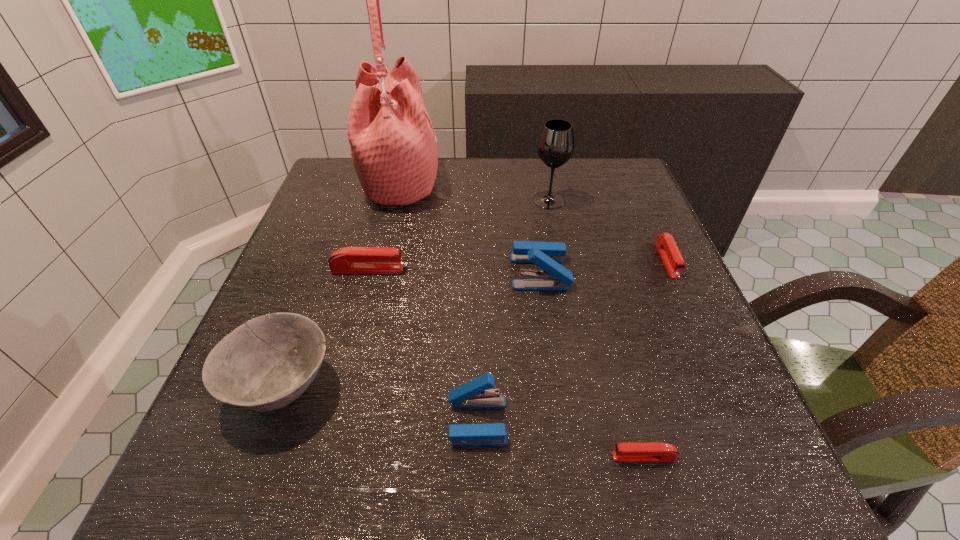
Identify the location of the second closest stapler to the smaller blue stapler. (547, 255).

Identify which red stapler is the third closest to the tallest object. Please provide its 2D coordinates. Your answer should be formatted as a tuple, i.e. [(x, y)], where the tuple contains the x and y coordinates of a point satisfying the conditions above.

[(648, 451)]

Locate an element on the screen. red stapler object that ranks as the second closest to the handbag is located at coordinates (665, 243).

Find the location of a particular element. blank space that satisfies the following two spatial constraints: 1. on the front-facing side of the rightmost stapler; 2. on the front-facing side of the nearest object is located at coordinates (756, 457).

What are the coordinates of `vacant space that satisfies the following two spatial constraints: 1. on the front-facing side of the rightmost stapler; 2. on the front-facing side of the shortest object` in the screenshot? It's located at (756, 457).

Where is `free spot that satisfies the following two spatial constraints: 1. on the front side of the wineglass; 2. on the front-facing side of the third tallest stapler`? free spot that satisfies the following two spatial constraints: 1. on the front side of the wineglass; 2. on the front-facing side of the third tallest stapler is located at coordinates (563, 269).

I want to click on vacant space that satisfies the following two spatial constraints: 1. on the front-facing side of the tallest stapler; 2. on the right side of the biggest red stapler, so click(x=367, y=272).

Image resolution: width=960 pixels, height=540 pixels. I want to click on vacant area in the image that satisfies the following two spatial constraints: 1. on the front-facing side of the third tallest stapler; 2. on the left side of the third stapler from left to right, so click(367, 272).

Find the location of a particular element. This screenshot has width=960, height=540. free space that satisfies the following two spatial constraints: 1. on the back side of the tallest object; 2. on the left side of the bowl is located at coordinates (358, 183).